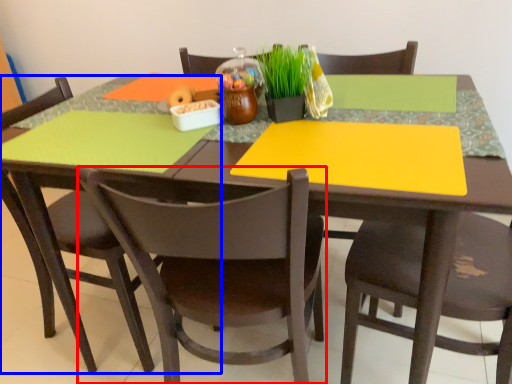
Question: Which of the following is the closest to the observer, chair (highlighted by a red box) or chair (highlighted by a blue box)?

Choices:
 (A) chair
 (B) chair

Answer: (A)